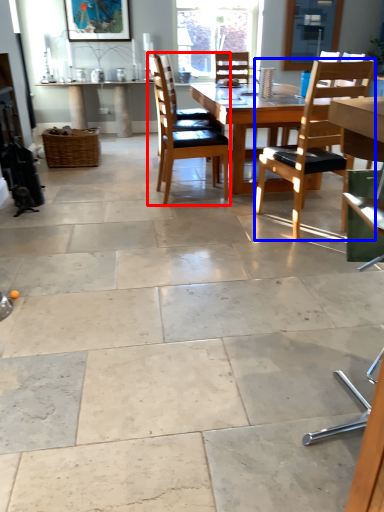
Question: Among these objects, which one is nearest to the camera, chair (highlighted by a red box) or chair (highlighted by a blue box)?

Choices:
 (A) chair
 (B) chair

Answer: (B)